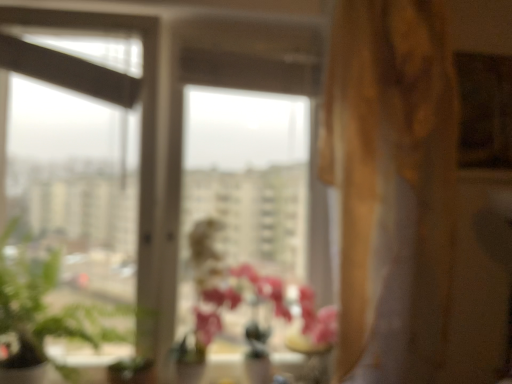
This screenshot has height=384, width=512. What do you see at coordinates (409, 204) in the screenshot?
I see `gold textured curtain at right` at bounding box center [409, 204].

Locate an element on the screen. The image size is (512, 384). transparent glass vase at center is located at coordinates (310, 358).

Describe the element at coordinates (310, 358) in the screenshot. I see `transparent glass vase at center` at that location.

Locate an element on the screen. green leafy plant at left is located at coordinates (46, 309).

I want to click on transparent glass window at center, so click(x=182, y=99).

How many degrees apart are the facing directions of transparent glass window at center and transparent glass vase at center?

The facing directions of transparent glass window at center and transparent glass vase at center are 3.17 degrees apart.

Between transparent glass window at center and transparent glass vase at center, which one is positioned behind?

transparent glass vase at center.

Are transparent glass window at center and transparent glass vase at center making contact?

transparent glass window at center is not next to transparent glass vase at center, and they're not touching.

I want to click on window that appears above the transparent glass vase at center (from the image's perspective), so click(x=182, y=99).

How many degrees apart are the facing directions of pink matte vase at center and transparent glass vase at center?

The facing directions of pink matte vase at center and transparent glass vase at center are 0.00034 degrees apart.

Which object is further away from the camera, pink matte vase at center or transparent glass vase at center?

transparent glass vase at center is further away from the camera.

Does pink matte vase at center have a greater height compared to transparent glass vase at center?

Indeed, pink matte vase at center has a greater height compared to transparent glass vase at center.

The width and height of the screenshot is (512, 384). Find the location of `flower on the left of transparent glass vase at center`. flower on the left of transparent glass vase at center is located at coordinates (238, 299).

Does gold textured curtain at right appear on the left side of transparent glass window at center?

Incorrect, gold textured curtain at right is not on the left side of transparent glass window at center.

Considering the positions of objects gold textured curtain at right and transparent glass window at center in the image provided, who is behind, gold textured curtain at right or transparent glass window at center?

transparent glass window at center is more distant.

In the scene shown: Who is shorter, gold textured curtain at right or transparent glass window at center?

transparent glass window at center.

From the image's perspective, is gold textured curtain at right above transparent glass window at center?

Indeed, from the image's perspective, gold textured curtain at right is shown above transparent glass window at center.

Is point (300, 335) positioned behind point (454, 251)?

That is False.

Between transparent glass vase at center and gold textured curtain at right, which one has more height?

gold textured curtain at right is taller.

Is transparent glass vase at center wider or thinner than gold textured curtain at right?

Considering their sizes, transparent glass vase at center looks slimmer than gold textured curtain at right.

From the image's perspective, between gold textured curtain at right and green leafy plant at left, who is located below?

green leafy plant at left, from the image's perspective.

Is gold textured curtain at right shorter than green leafy plant at left?

In fact, gold textured curtain at right may be taller than green leafy plant at left.

From a real-world perspective, which is physically above, gold textured curtain at right or green leafy plant at left?

gold textured curtain at right.

How many degrees apart are the facing directions of gold textured curtain at right and green leafy plant at left?

The angular difference between gold textured curtain at right and green leafy plant at left is 4.09 degrees.

From a real-world perspective, between transparent glass vase at center and transparent glass window at center, who is vertically higher?

From a 3D spatial view, transparent glass window at center is above.

How many degrees apart are the facing directions of transparent glass vase at center and transparent glass window at center?

The angle between the facing direction of transparent glass vase at center and the facing direction of transparent glass window at center is 3.17 degrees.

Which is behind, transparent glass vase at center or transparent glass window at center?

transparent glass vase at center is further from the camera.

Where is `plant located on the left of transparent glass window at center`? plant located on the left of transparent glass window at center is located at coordinates (46, 309).

Can you confirm if green leafy plant at left is taller than transparent glass window at center?

No.

Which object is wider, green leafy plant at left or transparent glass window at center?

With larger width is green leafy plant at left.

Considering the relative positions of green leafy plant at left and transparent glass window at center in the image provided, is green leafy plant at left in front of transparent glass window at center?

Yes, the depth of green leafy plant at left is less than that of transparent glass window at center.

You are a GUI agent. You are given a task and a screenshot of the screen. Output one action in this format:
    pyautogui.click(x=<x>, y=<y>)
    Task: Click on the window that appears above the transparent glass vase at center (from a real-world perspective)
    This screenshot has width=512, height=384.
    Given the screenshot: What is the action you would take?
    pyautogui.click(x=182, y=99)

At what (x,y) coordinates should I click in order to perform the action: click on flower on the left side of transparent glass vase at center. Please return your answer as a coordinate pair (x, y). Looking at the image, I should click on (238, 299).

Looking at the image, which one is located further to green leafy plant at left, gold textured curtain at right or pink matte vase at center?

gold textured curtain at right is further to green leafy plant at left.

When comparing their distances from gold textured curtain at right, does pink matte vase at center or green leafy plant at left seem closer?

pink matte vase at center is closer to gold textured curtain at right.

Looking at the image, which one is located closer to transparent glass window at center, pink matte vase at center or gold textured curtain at right?

Based on the image, pink matte vase at center appears to be nearer to transparent glass window at center.

Based on their spatial positions, is transparent glass vase at center or pink matte vase at center closer to gold textured curtain at right?

pink matte vase at center is closer to gold textured curtain at right.

Which object lies further to the anchor point transparent glass vase at center, transparent glass window at center or gold textured curtain at right?

transparent glass window at center lies further to transparent glass vase at center than the other object.

Based on their spatial positions, is transparent glass window at center or transparent glass vase at center further from gold textured curtain at right?

transparent glass window at center lies further to gold textured curtain at right than the other object.

Considering their positions, is transparent glass vase at center positioned closer to pink matte vase at center than transparent glass window at center?

Result: transparent glass vase at center.

When comparing their distances from green leafy plant at left, does gold textured curtain at right or transparent glass vase at center seem closer?

transparent glass vase at center is closer to green leafy plant at left.

Identify the location of window between green leafy plant at left and gold textured curtain at right in the horizontal direction. Image resolution: width=512 pixels, height=384 pixels. (182, 99).

The width and height of the screenshot is (512, 384). Find the location of `flower situated between green leafy plant at left and gold textured curtain at right from left to right`. flower situated between green leafy plant at left and gold textured curtain at right from left to right is located at coordinates (238, 299).

Locate an element on the screen. The image size is (512, 384). window situated between green leafy plant at left and transparent glass vase at center from left to right is located at coordinates (182, 99).

The height and width of the screenshot is (384, 512). Find the location of `window situated between green leafy plant at left and pink matte vase at center from left to right`. window situated between green leafy plant at left and pink matte vase at center from left to right is located at coordinates (182, 99).